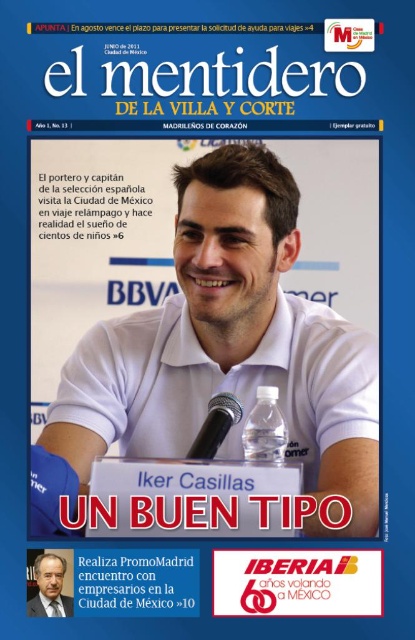
Who is lower down, white matte polo shirt at center or matte white shirt at center?

matte white shirt at center

At what (x,y) coordinates should I click in order to perform the action: click on white matte polo shirt at center. Please return your answer as a coordinate pair (x, y). The image size is (415, 640). Looking at the image, I should click on (229, 390).

Between point (48, 582) and point (209, 424), which one is positioned behind?

Point (209, 424)

Does matte white shirt at center have a larger size compared to black plastic microphone at center?

No, matte white shirt at center is not bigger than black plastic microphone at center.

Who is more distant from viewer, (46, 586) or (209, 413)?

Point (209, 413)

At what (x,y) coordinates should I click in order to perform the action: click on matte white shirt at center. Please return your answer as a coordinate pair (x, y). Looking at the image, I should click on (49, 588).

Does clear plastic water bottle at center have a smaller size compared to matte white shirt at center?

No.

The width and height of the screenshot is (415, 640). What do you see at coordinates (265, 428) in the screenshot? I see `clear plastic water bottle at center` at bounding box center [265, 428].

Between point (278, 417) and point (44, 604), which one is positioned behind?

Point (278, 417)

Find the location of `clear plastic water bottle at center`. clear plastic water bottle at center is located at coordinates (265, 428).